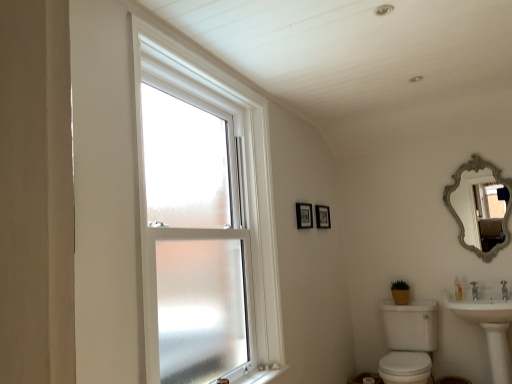
This screenshot has width=512, height=384. I want to click on white glossy sink at lower right, the first sink positioned from the left, so click(411, 325).

What do you see at coordinates (411, 325) in the screenshot?
I see `white glossy sink at lower right, the first sink positioned from the left` at bounding box center [411, 325].

What do you see at coordinates (261, 376) in the screenshot? I see `white plastic window sill at lower center` at bounding box center [261, 376].

Describe the element at coordinates (479, 207) in the screenshot. I see `silver/gilded ornate mirror at upper right` at that location.

I want to click on wooden picture frame at upper center, positioned as the 1th picture frame in right-to-left order, so click(322, 216).

Where is `white glossy sink at lower right, the second sink positioned from the left`? This screenshot has height=384, width=512. white glossy sink at lower right, the second sink positioned from the left is located at coordinates (488, 323).

Which of these two, matte black picture frame at upper center, which ranks as the first picture frame in front-to-back order, or white glossy sink at lower right, the first sink positioned from the left, is wider?

white glossy sink at lower right, the first sink positioned from the left.

Is matte black picture frame at upper center, marked as the 1th picture frame in a left-to-right arrangement, taller than white glossy sink at lower right, the first sink positioned from the left?

No, matte black picture frame at upper center, marked as the 1th picture frame in a left-to-right arrangement, is not taller than white glossy sink at lower right, the first sink positioned from the left.

Between matte black picture frame at upper center, marked as the 2th picture frame in a right-to-left arrangement, and white glossy sink at lower right, arranged as the 2th sink when viewed from the right, which one appears on the left side from the viewer's perspective?

matte black picture frame at upper center, marked as the 2th picture frame in a right-to-left arrangement, is more to the left.

Is matte black picture frame at upper center, marked as the 2th picture frame in a right-to-left arrangement, oriented towards white glossy sink at lower right, arranged as the 2th sink when viewed from the right?

No.

From the image's perspective, which one is positioned lower, wooden picture frame at upper center, placed as the second picture frame when sorted from front to back, or frosted glass window at center?

wooden picture frame at upper center, placed as the second picture frame when sorted from front to back, from the image's perspective.

From a real-world perspective, is wooden picture frame at upper center, placed as the second picture frame when sorted from front to back, under frosted glass window at center?

Actually, wooden picture frame at upper center, placed as the second picture frame when sorted from front to back, is physically above frosted glass window at center in the real world.

Is wooden picture frame at upper center, the first picture frame viewed from the back, wider than frosted glass window at center?

Incorrect, the width of wooden picture frame at upper center, the first picture frame viewed from the back, does not surpass that of frosted glass window at center.

Is wooden picture frame at upper center, positioned as the second picture frame in left-to-right order, inside or outside of frosted glass window at center?

wooden picture frame at upper center, positioned as the second picture frame in left-to-right order, is located beyond the bounds of frosted glass window at center.

Which object is more forward, wooden picture frame at upper center, placed as the second picture frame when sorted from front to back, or white glossy sink at lower right, arranged as the 2th sink when viewed from the right?

white glossy sink at lower right, arranged as the 2th sink when viewed from the right, is closer to the camera.

Is wooden picture frame at upper center, positioned as the second picture frame in left-to-right order, beside white glossy sink at lower right, the first sink positioned from the left?

No, wooden picture frame at upper center, positioned as the second picture frame in left-to-right order, is not touching white glossy sink at lower right, the first sink positioned from the left.

Consider the image. Does wooden picture frame at upper center, positioned as the second picture frame in left-to-right order, have a greater height compared to white glossy sink at lower right, the first sink positioned from the left?

In fact, wooden picture frame at upper center, positioned as the second picture frame in left-to-right order, may be shorter than white glossy sink at lower right, the first sink positioned from the left.

Considering the relative sizes of silver/gilded ornate mirror at upper right and white plastic window sill at lower center in the image provided, is silver/gilded ornate mirror at upper right shorter than white plastic window sill at lower center?

No, silver/gilded ornate mirror at upper right is not shorter than white plastic window sill at lower center.

Is silver/gilded ornate mirror at upper right spatially inside white plastic window sill at lower center, or outside of it?

silver/gilded ornate mirror at upper right is not enclosed by white plastic window sill at lower center.

What's the angular difference between silver/gilded ornate mirror at upper right and white plastic window sill at lower center's facing directions?

92.3 degrees separate the facing orientations of silver/gilded ornate mirror at upper right and white plastic window sill at lower center.

Is silver/gilded ornate mirror at upper right with white plastic window sill at lower center?

No.

Consider the image. Is silver/gilded ornate mirror at upper right at the left side of matte black picture frame at upper center, marked as the 2th picture frame in a right-to-left arrangement?

No.

I want to click on mirror on the right of the matte black picture frame at upper center, marked as the 1th picture frame in a left-to-right arrangement, so tap(479, 207).

Are silver/gilded ornate mirror at upper right and matte black picture frame at upper center, which ranks as the first picture frame in front-to-back order, located far from each other?

Yes, silver/gilded ornate mirror at upper right and matte black picture frame at upper center, which ranks as the first picture frame in front-to-back order, are quite far apart.

Is matte black picture frame at upper center, which ranks as the first picture frame in front-to-back order, oriented towards white plastic window sill at lower center?

No, matte black picture frame at upper center, which ranks as the first picture frame in front-to-back order, is not turned towards white plastic window sill at lower center.

From a real-world perspective, is matte black picture frame at upper center, which ranks as the 2th picture frame in back-to-front order, physically below white plastic window sill at lower center?

No, from a real-world perspective, matte black picture frame at upper center, which ranks as the 2th picture frame in back-to-front order, is not below white plastic window sill at lower center.

From the picture: Considering the relative positions of matte black picture frame at upper center, which ranks as the first picture frame in front-to-back order, and white plastic window sill at lower center in the image provided, is matte black picture frame at upper center, which ranks as the first picture frame in front-to-back order, to the left or to the right of white plastic window sill at lower center?

Clearly, matte black picture frame at upper center, which ranks as the first picture frame in front-to-back order, is on the right of white plastic window sill at lower center in the image.

In terms of height, does matte black picture frame at upper center, which ranks as the 2th picture frame in back-to-front order, look taller or shorter compared to white plastic window sill at lower center?

In the image, matte black picture frame at upper center, which ranks as the 2th picture frame in back-to-front order, appears to be taller than white plastic window sill at lower center.

Does point (505, 340) come behind point (319, 221)?

No, it is in front of (319, 221).

Would you say wooden picture frame at upper center, positioned as the second picture frame in left-to-right order, is part of white glossy sink at lower right, the 1th sink viewed from the right,'s contents?

No, wooden picture frame at upper center, positioned as the second picture frame in left-to-right order, is located outside of white glossy sink at lower right, the 1th sink viewed from the right.

Does white glossy sink at lower right, the 1th sink viewed from the right, turn towards wooden picture frame at upper center, positioned as the 1th picture frame in right-to-left order?

No, white glossy sink at lower right, the 1th sink viewed from the right, does not turn towards wooden picture frame at upper center, positioned as the 1th picture frame in right-to-left order.

Is white glossy sink at lower right, the 1th sink viewed from the right, positioned far away from wooden picture frame at upper center, positioned as the second picture frame in left-to-right order?

white glossy sink at lower right, the 1th sink viewed from the right, is far away from wooden picture frame at upper center, positioned as the second picture frame in left-to-right order.

Which sink is the 1st one when counting from the right side of the matte black picture frame at upper center, which ranks as the 2th picture frame in back-to-front order? Please provide its 2D coordinates.

[(411, 325)]

I want to click on window above the wooden picture frame at upper center, positioned as the second picture frame in left-to-right order (from the image's perspective), so click(202, 220).

Considering their positions, is white glossy sink at lower right, arranged as the 2th sink when viewed from the right, positioned further to silver/gilded ornate mirror at upper right than white glossy sink at lower right, the 1th sink viewed from the right?

white glossy sink at lower right, arranged as the 2th sink when viewed from the right, lies further to silver/gilded ornate mirror at upper right than the other object.

Consider the image. Which object lies further to the anchor point white plastic window sill at lower center, white glossy sink at lower right, the 1th sink viewed from the right, or frosted glass window at center?

white glossy sink at lower right, the 1th sink viewed from the right, lies further to white plastic window sill at lower center than the other object.

Looking at the image, which one is located further to white glossy sink at lower right, arranged as the 2th sink when viewed from the right, white plastic window sill at lower center or frosted glass window at center?

frosted glass window at center is positioned further to the anchor white glossy sink at lower right, arranged as the 2th sink when viewed from the right.

Estimate the real-world distances between objects in this image. Which object is closer to frosted glass window at center, white glossy sink at lower right, the 1th sink viewed from the right, or silver/gilded ornate mirror at upper right?

The object closer to frosted glass window at center is white glossy sink at lower right, the 1th sink viewed from the right.

Looking at the image, which one is located further to silver/gilded ornate mirror at upper right, wooden picture frame at upper center, positioned as the second picture frame in left-to-right order, or white glossy sink at lower right, the first sink positioned from the left?

wooden picture frame at upper center, positioned as the second picture frame in left-to-right order, is further to silver/gilded ornate mirror at upper right.

When comparing their distances from white glossy sink at lower right, arranged as the 2th sink when viewed from the right, does white glossy sink at lower right, the 1th sink viewed from the right, or frosted glass window at center seem further?

Based on the image, frosted glass window at center appears to be further to white glossy sink at lower right, arranged as the 2th sink when viewed from the right.

Looking at the image, which one is located closer to silver/gilded ornate mirror at upper right, matte black picture frame at upper center, marked as the 2th picture frame in a right-to-left arrangement, or white glossy sink at lower right, the 1th sink viewed from the right?

The object closer to silver/gilded ornate mirror at upper right is white glossy sink at lower right, the 1th sink viewed from the right.

Which object lies nearer to the anchor point wooden picture frame at upper center, the first picture frame viewed from the back, frosted glass window at center or white glossy sink at lower right, the first sink positioned from the left?

Based on the image, white glossy sink at lower right, the first sink positioned from the left, appears to be nearer to wooden picture frame at upper center, the first picture frame viewed from the back.

The height and width of the screenshot is (384, 512). What are the coordinates of `window sill between frosted glass window at center and wooden picture frame at upper center, positioned as the second picture frame in left-to-right order, in the front-back direction` in the screenshot? It's located at (261, 376).

Identify the location of window sill situated between frosted glass window at center and silver/gilded ornate mirror at upper right from left to right. (261, 376).

Where is `sink between matte black picture frame at upper center, marked as the 2th picture frame in a right-to-left arrangement, and white glossy sink at lower right, the 1th sink viewed from the right`? The width and height of the screenshot is (512, 384). sink between matte black picture frame at upper center, marked as the 2th picture frame in a right-to-left arrangement, and white glossy sink at lower right, the 1th sink viewed from the right is located at coordinates (411, 325).

At what (x,y) coordinates should I click in order to perform the action: click on picture frame situated between matte black picture frame at upper center, marked as the 2th picture frame in a right-to-left arrangement, and white glossy sink at lower right, the 1th sink viewed from the right, from left to right. Please return your answer as a coordinate pair (x, y). The width and height of the screenshot is (512, 384). Looking at the image, I should click on (322, 216).